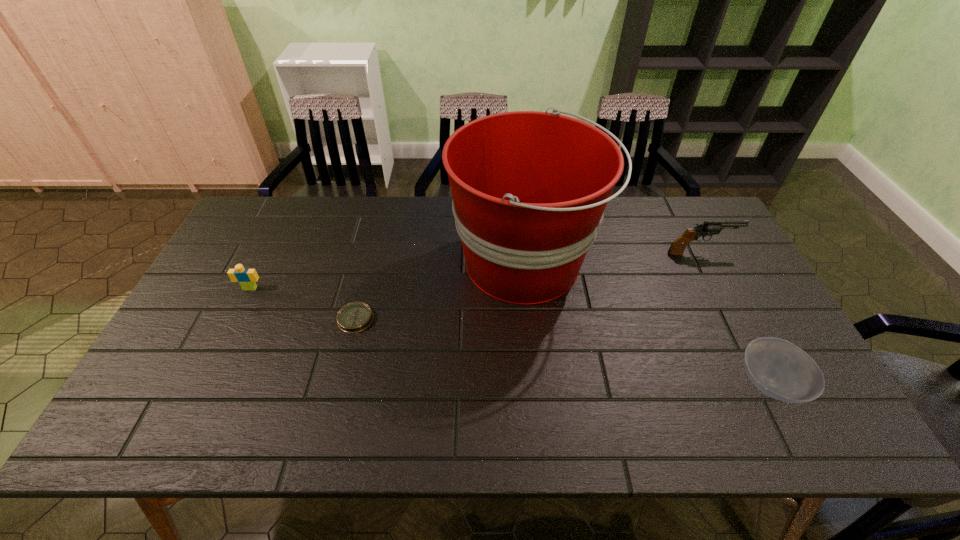
You are a GUI agent. You are given a task and a screenshot of the screen. Output one action in this format:
    pyautogui.click(x=<x>, y=<y>)
    Task: Click on the free space located on the face of the third tallest object
    The width and height of the screenshot is (960, 540).
    Given the screenshot: What is the action you would take?
    pyautogui.click(x=240, y=310)

The image size is (960, 540). I want to click on vacant space located on the left of the nearest object, so [643, 384].

At what (x,y) coordinates should I click in order to perform the action: click on free space located 0.370m on the left of the compass. Please return your answer as a coordinate pair (x, y). Looking at the image, I should click on point(202,319).

Where is `object that is at the far edge`? This screenshot has height=540, width=960. object that is at the far edge is located at coordinates (529, 188).

The height and width of the screenshot is (540, 960). I want to click on object at the near edge, so click(781, 370).

I want to click on object that is at the left edge, so click(x=246, y=277).

Locate an element on the screen. The height and width of the screenshot is (540, 960). gun that is at the right edge is located at coordinates (708, 228).

Where is `bowl that is at the right edge`? The width and height of the screenshot is (960, 540). bowl that is at the right edge is located at coordinates (781, 370).

Where is `object positioned at the near right corner`? This screenshot has width=960, height=540. object positioned at the near right corner is located at coordinates (781, 370).

The image size is (960, 540). What are the coordinates of `free region at the far edge of the desktop` in the screenshot? It's located at (383, 221).